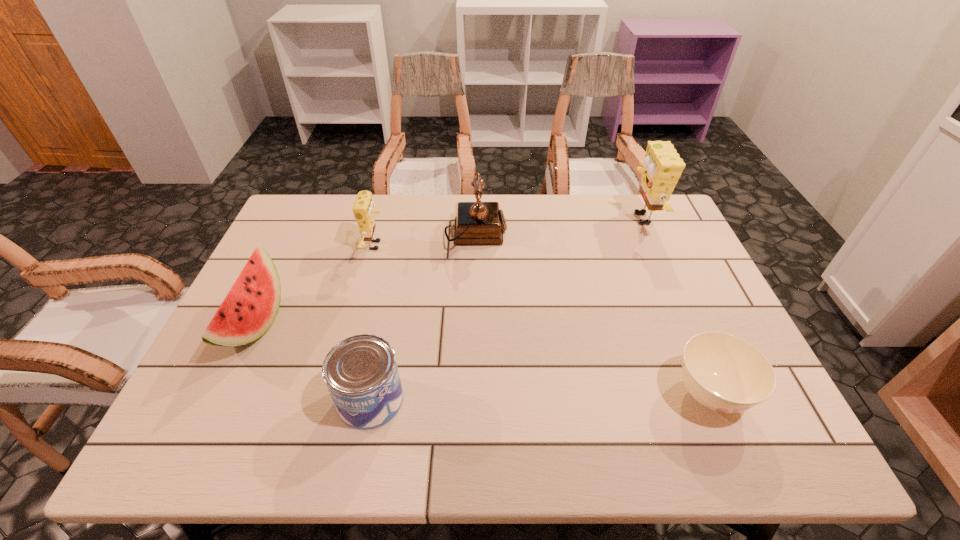
Where is `vacant space located 0.200m on the face of the left sponge`? vacant space located 0.200m on the face of the left sponge is located at coordinates (451, 246).

This screenshot has height=540, width=960. I want to click on blank space located on the dial of the telephone, so click(548, 234).

Locate an element on the screen. free location located 0.330m on the outer rind of the watermelon is located at coordinates (405, 325).

You are a GUI agent. You are given a task and a screenshot of the screen. Output one action in this format:
    pyautogui.click(x=<x>, y=<y>)
    Task: Click on the free space located 0.050m on the front label of the can
    The image size is (960, 540).
    Given the screenshot: What is the action you would take?
    pyautogui.click(x=426, y=400)

Find the location of a particular element. The image size is (960, 540). vacant space located on the back of the sugar bowl is located at coordinates (686, 338).

The width and height of the screenshot is (960, 540). I want to click on telephone positioned at the far edge, so (477, 223).

Find the location of a particular element. can positioned at the near edge is located at coordinates 361,373.

This screenshot has width=960, height=540. What are the coordinates of `sugar bowl situated at the near edge` in the screenshot? It's located at (724, 373).

In order to click on object located at the left edge in this screenshot , I will do `click(249, 309)`.

The image size is (960, 540). I want to click on sponge present at the right edge, so click(x=662, y=167).